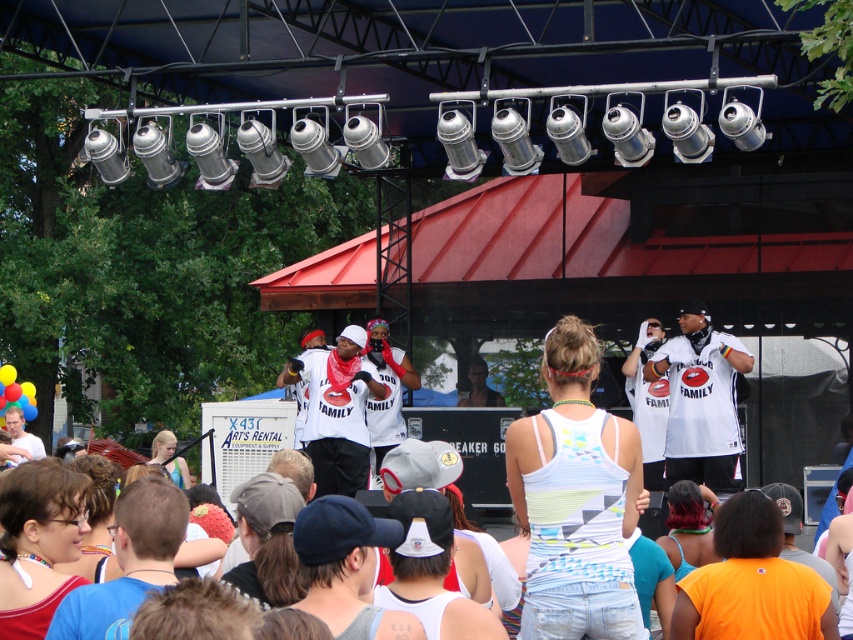
Question: Is white tank top at center wider than white jersey at center?

Choices:
 (A) no
 (B) yes

Answer: (A)

Question: Is white tank top at center positioned at the back of white matte shirt at center?

Choices:
 (A) yes
 (B) no

Answer: (B)

Question: Which point is farther from the camera taking this photo?

Choices:
 (A) pyautogui.click(x=608, y=458)
 (B) pyautogui.click(x=724, y=470)

Answer: (B)

Question: Where is white jersey at center located in relation to white matte shirt at center in the image?

Choices:
 (A) right
 (B) left

Answer: (A)

Question: Which of these objects is positioned farthest from the white tank top at center?

Choices:
 (A) white jersey at center
 (B) white matte shirt at center

Answer: (B)

Question: Which object appears farthest from the camera in this image?

Choices:
 (A) white matte shirt at center
 (B) white tank top at center

Answer: (A)